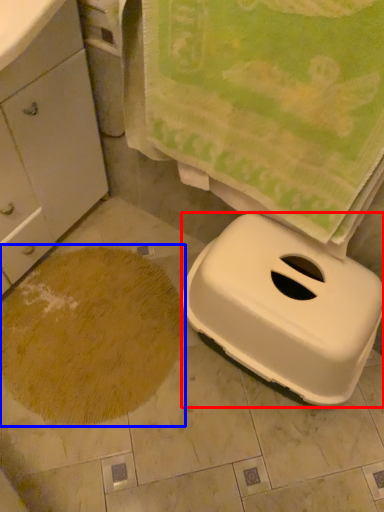
Question: Which object appears closest to the camera in this image, appliance (highlighted by a red box) or sand (highlighted by a blue box)?

Choices:
 (A) appliance
 (B) sand

Answer: (A)